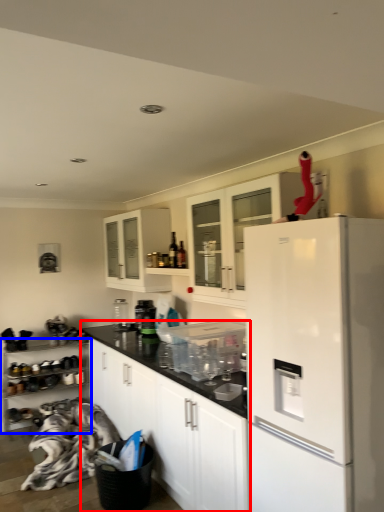
Question: Which of the following is the farthest to the observer, cabinetry (highlighted by a red box) or cabinetry (highlighted by a blue box)?

Choices:
 (A) cabinetry
 (B) cabinetry

Answer: (B)